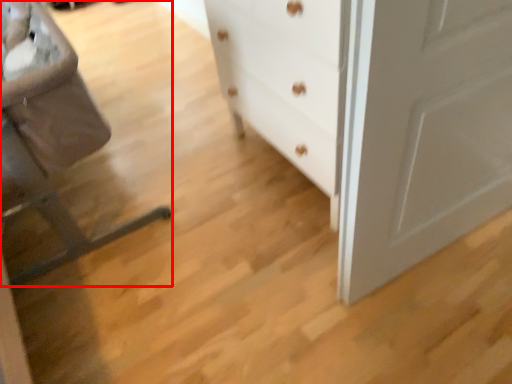
Question: In this image, where is rocking chair (annotated by the red box) located relative to chest of drawers?

Choices:
 (A) left
 (B) right

Answer: (A)